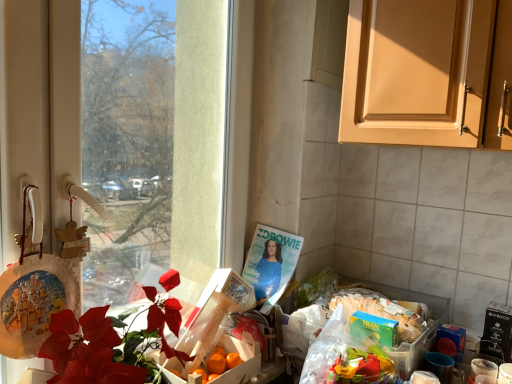
This screenshot has width=512, height=384. What do you see at coordinates (271, 264) in the screenshot? I see `matte paper magazine at center` at bounding box center [271, 264].

Image resolution: width=512 pixels, height=384 pixels. I want to click on green matte box of tran rice at lower right, so (380, 310).

Find the location of a particular element. white glossy coffee cup at lower right is located at coordinates (483, 371).

This screenshot has width=512, height=384. I want to click on the 1st box counting from the left side of the green matte box of tran rice at lower right, so click(210, 318).

How distant is green matte box of tran rice at lower right from wooden crate of oranges at center, which ranks as the 2th box in bottom-to-top order?

15.87 inches.

Is green matte box of tran rice at lower right directly adjacent to wooden crate of oranges at center, which ranks as the 2th box in bottom-to-top order?

No, green matte box of tran rice at lower right is not making contact with wooden crate of oranges at center, which ranks as the 2th box in bottom-to-top order.

Is green matte box of tran rice at lower right taller than wooden crate of oranges at center, which is the 1th box in top-to-bottom order?

No, green matte box of tran rice at lower right is not taller than wooden crate of oranges at center, which is the 1th box in top-to-bottom order.

Considering the positions of points (254, 369) and (252, 267), is point (254, 369) closer to camera compared to point (252, 267)?

That is True.

Are orange matte box at center, positioned as the first box in bottom-to-top order, and matte paper magazine at center far apart?

No, orange matte box at center, positioned as the first box in bottom-to-top order, is not far away from matte paper magazine at center.

Would you say orange matte box at center, the 2th box when ordered from top to bottom, is inside or outside matte paper magazine at center?

orange matte box at center, the 2th box when ordered from top to bottom, exists outside the volume of matte paper magazine at center.

Is matte paper magazine at center facing towards white glossy coffee cup at lower right?

No, matte paper magazine at center is not turned towards white glossy coffee cup at lower right.

Considering their positions, is matte paper magazine at center located in front of or behind white glossy coffee cup at lower right?

Clearly, matte paper magazine at center is behind white glossy coffee cup at lower right.

Consider the image. From a real-world perspective, is matte paper magazine at center over white glossy coffee cup at lower right?

Yes, from a real-world perspective, matte paper magazine at center is on top of white glossy coffee cup at lower right.

Based on the photo, which point is more distant from viewer, (289, 266) or (492, 369)?

Point (289, 266)

From the image's perspective, who appears lower, wooden crate of oranges at center, which is the 1th box in top-to-bottom order, or matte paper magazine at center?

From the image's view, wooden crate of oranges at center, which is the 1th box in top-to-bottom order, is below.

Looking at this image, considering the sizes of objects wooden crate of oranges at center, which ranks as the 2th box in bottom-to-top order, and matte paper magazine at center in the image provided, who is thinner, wooden crate of oranges at center, which ranks as the 2th box in bottom-to-top order, or matte paper magazine at center?

With smaller width is matte paper magazine at center.

Which object is closer to the camera taking this photo, wooden crate of oranges at center, which is the 1th box in top-to-bottom order, or matte paper magazine at center?

Positioned in front is wooden crate of oranges at center, which is the 1th box in top-to-bottom order.

Considering the relative sizes of wooden crate of oranges at center, which is the 1th box in top-to-bottom order, and matte paper magazine at center in the image provided, is wooden crate of oranges at center, which is the 1th box in top-to-bottom order, bigger than matte paper magazine at center?

Yes.

Can you confirm if orange matte box at center, the 2th box when ordered from top to bottom, is wider than green matte box of tran rice at lower right?

No.

Measure the distance between orange matte box at center, positioned as the first box in bottom-to-top order, and green matte box of tran rice at lower right.

orange matte box at center, positioned as the first box in bottom-to-top order, and green matte box of tran rice at lower right are 16.05 inches apart.

Can you confirm if orange matte box at center, the 2th box when ordered from top to bottom, is taller than green matte box of tran rice at lower right?

Correct, orange matte box at center, the 2th box when ordered from top to bottom, is much taller as green matte box of tran rice at lower right.

Is orange matte box at center, positioned as the first box in bottom-to-top order, surrounding green matte box of tran rice at lower right?

No, green matte box of tran rice at lower right is not surrounded by orange matte box at center, positioned as the first box in bottom-to-top order.

From a real-world perspective, is green matte box of tran rice at lower right below transparent glass window at left?

Yes.

Is transparent glass window at left inside green matte box of tran rice at lower right?

No, transparent glass window at left is located outside of green matte box of tran rice at lower right.

Considering the positions of point (352, 292) and point (46, 18), is point (352, 292) closer or farther from the camera than point (46, 18)?

Point (352, 292) is farther from the camera than point (46, 18).

Is orange matte box at center, the 2th box when ordered from top to bottom, bigger or smaller than wooden crate of oranges at center, which ranks as the 2th box in bottom-to-top order?

In the image, orange matte box at center, the 2th box when ordered from top to bottom, appears to be smaller than wooden crate of oranges at center, which ranks as the 2th box in bottom-to-top order.

Consider the image. Considering their positions, is orange matte box at center, the 2th box when ordered from top to bottom, located in front of or behind wooden crate of oranges at center, which ranks as the 2th box in bottom-to-top order?

orange matte box at center, the 2th box when ordered from top to bottom, is in front of wooden crate of oranges at center, which ranks as the 2th box in bottom-to-top order.

How many degrees apart are the facing directions of orange matte box at center, the 2th box when ordered from top to bottom, and wooden crate of oranges at center, which is the 1th box in top-to-bottom order?

17.1 degrees.

Based on the photo, considering the relative positions of orange matte box at center, the 2th box when ordered from top to bottom, and wooden crate of oranges at center, which ranks as the 2th box in bottom-to-top order, in the image provided, is orange matte box at center, the 2th box when ordered from top to bottom, to the left of wooden crate of oranges at center, which ranks as the 2th box in bottom-to-top order, from the viewer's perspective?

Yes.

Which box is the 1st one when counting from the front of the green matte box of tran rice at lower right? Please provide its 2D coordinates.

[(210, 318)]

Find the location of a particular element. magazine that is above the orange matte box at center, positioned as the first box in bottom-to-top order (from the image's perspective) is located at coordinates (271, 264).

Which object lies further to the anchor point transparent glass window at left, wooden crate of oranges at center, which ranks as the 2th box in bottom-to-top order, or matte paper magazine at center?

matte paper magazine at center.

Considering their positions, is orange matte box at center, positioned as the first box in bottom-to-top order, positioned closer to transparent glass window at left than matte paper magazine at center?

matte paper magazine at center is closer to transparent glass window at left.

Based on their spatial positions, is green matte box of tran rice at lower right or orange matte box at center, the 2th box when ordered from top to bottom, further from matte paper magazine at center?

green matte box of tran rice at lower right lies further to matte paper magazine at center than the other object.

Which object lies further to the anchor point orange matte box at center, the 2th box when ordered from top to bottom, transparent glass window at left or green matte box of tran rice at lower right?

The object further to orange matte box at center, the 2th box when ordered from top to bottom, is transparent glass window at left.

Looking at the image, which one is located closer to orange matte box at center, the 2th box when ordered from top to bottom, transparent glass window at left or white glossy coffee cup at lower right?

transparent glass window at left.

Estimate the real-world distances between objects in this image. Which object is closer to orange matte box at center, the 2th box when ordered from top to bottom, wooden crate of oranges at center, which ranks as the 2th box in bottom-to-top order, or green matte box of tran rice at lower right?

wooden crate of oranges at center, which ranks as the 2th box in bottom-to-top order, is closer to orange matte box at center, the 2th box when ordered from top to bottom.

Based on their spatial positions, is green matte box of tran rice at lower right or matte paper magazine at center further from orange matte box at center, the 2th box when ordered from top to bottom?

Among the two, green matte box of tran rice at lower right is located further to orange matte box at center, the 2th box when ordered from top to bottom.

Which object lies nearer to the anchor point wooden crate of oranges at center, which is the 1th box in top-to-bottom order, matte paper magazine at center or orange matte box at center, positioned as the first box in bottom-to-top order?

The object closer to wooden crate of oranges at center, which is the 1th box in top-to-bottom order, is orange matte box at center, positioned as the first box in bottom-to-top order.

Identify the location of food between orange matte box at center, positioned as the first box in bottom-to-top order, and white glossy coffee cup at lower right. (380, 310).

Locate an element on the screen. magazine between orange matte box at center, the 2th box when ordered from top to bottom, and green matte box of tran rice at lower right from left to right is located at coordinates (271, 264).

The image size is (512, 384). What are the coordinates of `magazine situated between orange matte box at center, the 2th box when ordered from top to bottom, and white glossy coffee cup at lower right from left to right` in the screenshot? It's located at (271, 264).

Where is `box between matte paper magazine at center and orange matte box at center, the 2th box when ordered from top to bottom, in the up-down direction`? This screenshot has height=384, width=512. box between matte paper magazine at center and orange matte box at center, the 2th box when ordered from top to bottom, in the up-down direction is located at coordinates (210, 318).